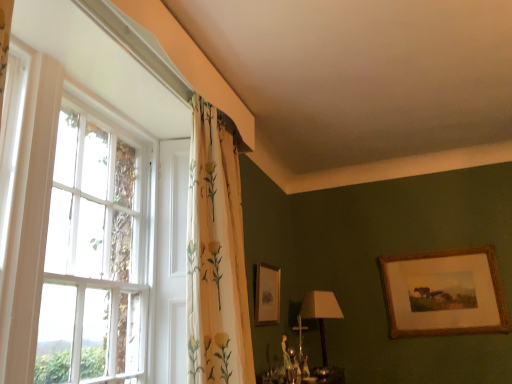
Question: From a real-world perspective, is matte beige lampshade at lower center positioned under white wooden window at left based on gravity?

Choices:
 (A) no
 (B) yes

Answer: (B)

Question: From the image's perspective, is matte beige lampshade at lower center below white wooden window at left?

Choices:
 (A) yes
 (B) no

Answer: (A)

Question: Is matte beige lampshade at lower center with white wooden window at left?

Choices:
 (A) no
 (B) yes

Answer: (A)

Question: Is matte beige lampshade at lower center closer to camera compared to white wooden window at left?

Choices:
 (A) no
 (B) yes

Answer: (A)

Question: Is matte beige lampshade at lower center taller than white wooden window at left?

Choices:
 (A) no
 (B) yes

Answer: (A)

Question: Is matte beige lampshade at lower center outside white wooden window at left?

Choices:
 (A) yes
 (B) no

Answer: (A)

Question: From the image's perspective, is white wooden window at left below gold-framed picture at upper right, positioned as the first picture frame in left-to-right order?

Choices:
 (A) yes
 (B) no

Answer: (B)

Question: From a real-world perspective, is white wooden window at left located higher than gold-framed picture at upper right, positioned as the first picture frame in left-to-right order?

Choices:
 (A) no
 (B) yes

Answer: (B)

Question: Can you confirm if white wooden window at left is wider than gold-framed picture at upper right, positioned as the first picture frame in left-to-right order?

Choices:
 (A) yes
 (B) no

Answer: (A)

Question: Is gold-framed picture at upper right, positioned as the first picture frame in left-to-right order, at the back of white wooden window at left?

Choices:
 (A) yes
 (B) no

Answer: (B)

Question: Can you confirm if white wooden window at left is thinner than gold-framed picture at upper right, the second picture frame positioned from the right?

Choices:
 (A) no
 (B) yes

Answer: (A)

Question: Is white wooden window at left smaller than gold-framed picture at upper right, the second picture frame positioned from the right?

Choices:
 (A) yes
 (B) no

Answer: (B)

Question: Is white wooden window at left with matte beige lampshade at lower center?

Choices:
 (A) yes
 (B) no

Answer: (B)